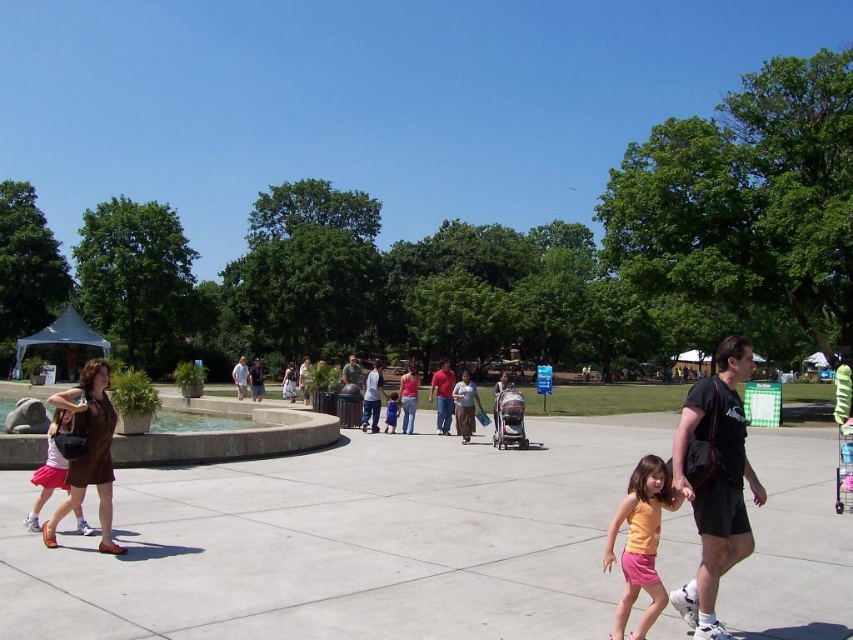
Question: In this image, where is pink matte skirt at lower left located relative to matte red shirt at center?

Choices:
 (A) below
 (B) above

Answer: (B)

Question: Which object is the closest to the pink matte skirt at lower left?

Choices:
 (A) blue denim shorts at center
 (B) black fabric shirt at center-right

Answer: (B)

Question: Among these objects, which one is farthest from the camera?

Choices:
 (A) orange matte tank top at lower center
 (B) pink matte skirt at lower left

Answer: (B)

Question: Is smooth concrete fountain at center left bigger than blue denim shorts at center?

Choices:
 (A) no
 (B) yes

Answer: (B)

Question: Can you confirm if matte brown dress at left is positioned below pink matte skirt at lower left?

Choices:
 (A) yes
 (B) no

Answer: (A)

Question: Which of the following is the farthest from the observer?

Choices:
 (A) matte brown dress at left
 (B) black fabric shirt at center-right
 (C) pink matte skirt at lower left

Answer: (C)